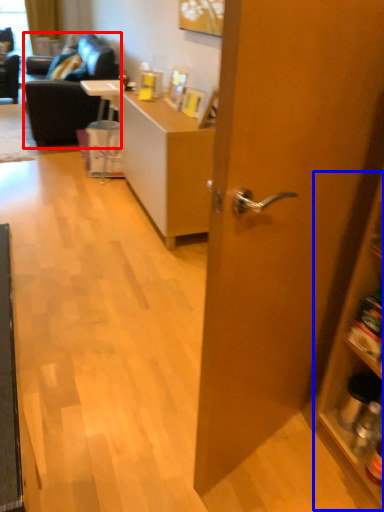
Question: Which of the following is the closest to the observer, studio couch (highlighted by a red box) or cabinetry (highlighted by a blue box)?

Choices:
 (A) studio couch
 (B) cabinetry

Answer: (B)